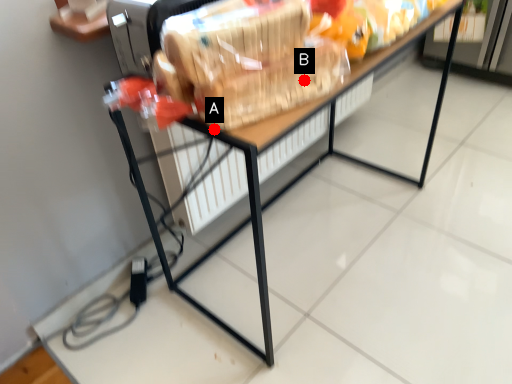
Question: Two points are circled on the image, labeled by A and B beside each circle. Among these points, which one is farthest from the camera?

Choices:
 (A) A is further
 (B) B is further

Answer: (B)